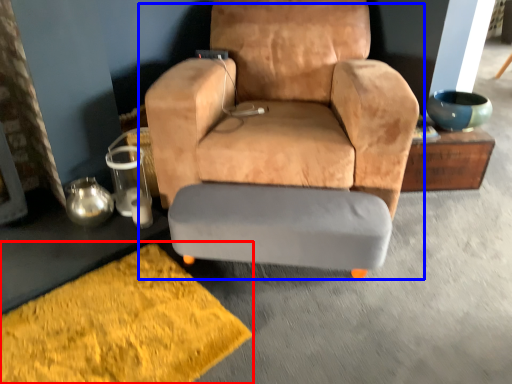
Question: Among these objects, which one is farthest to the camera, doormat (highlighted by a red box) or chair (highlighted by a blue box)?

Choices:
 (A) doormat
 (B) chair

Answer: (B)